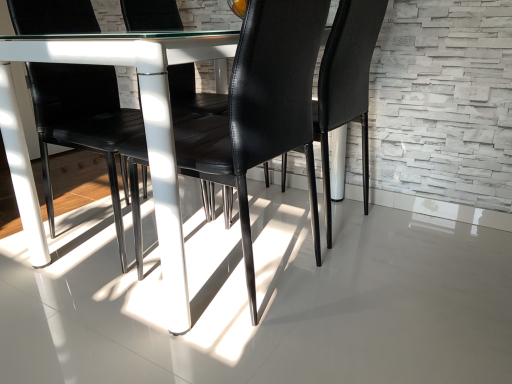
Identify the location of vacant space to the right of black leather chair at center, arranged as the 2th chair when viewed from the back. This screenshot has height=384, width=512. (383, 292).